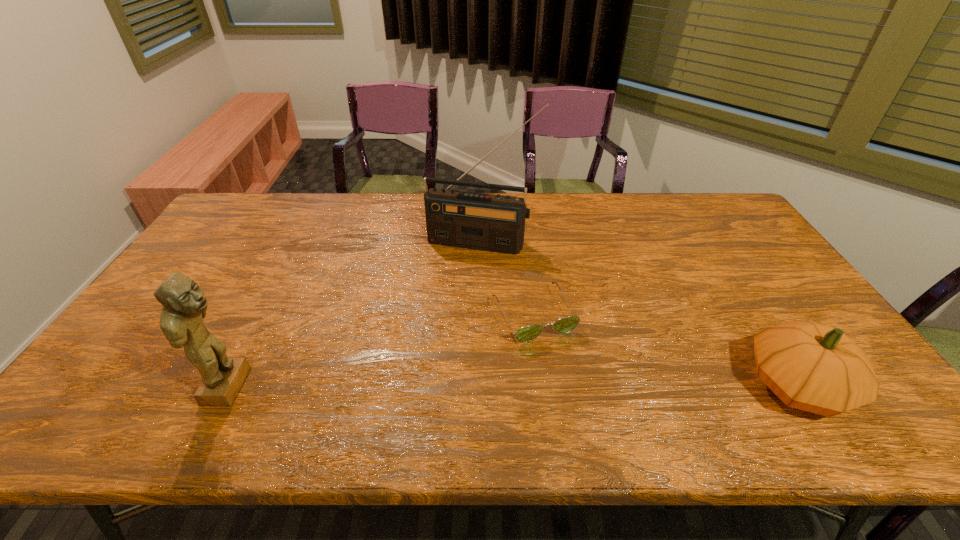
I want to click on vacant spot on the desktop that is between the third shortest object and the gourd and is positioned on the front-facing side of the tallest object, so click(431, 386).

Locate an element on the screen. This screenshot has width=960, height=540. free spot on the desktop that is between the second tallest object and the second shortest object and is positioned on the front-facing side of the shortest object is located at coordinates (573, 386).